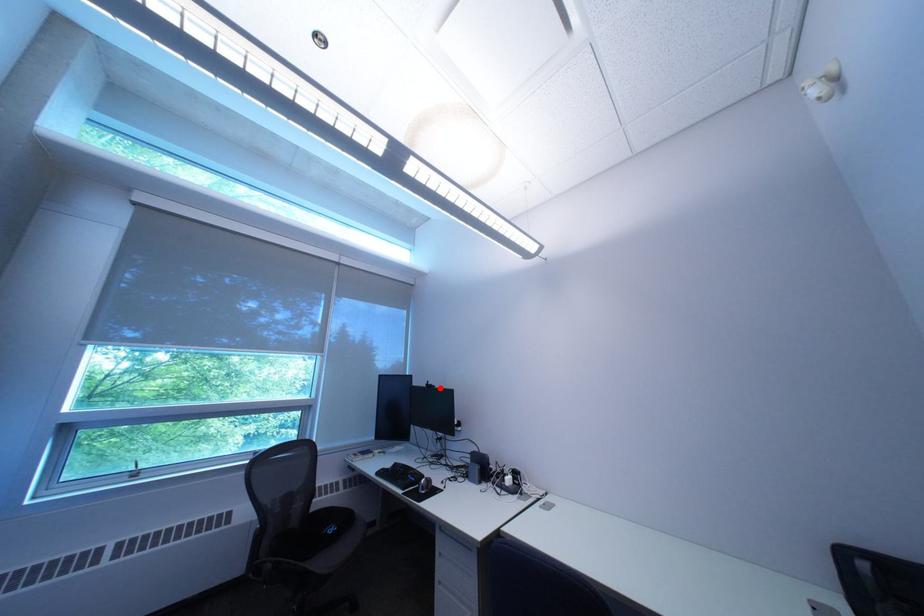
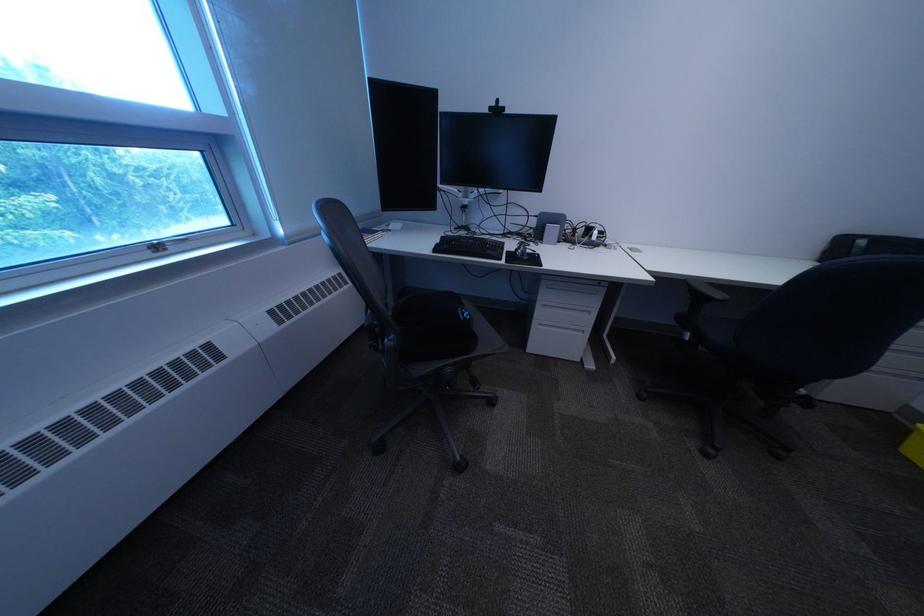
Where in the second image is the point corresponding to the highlighted location from the first image?

(503, 113)